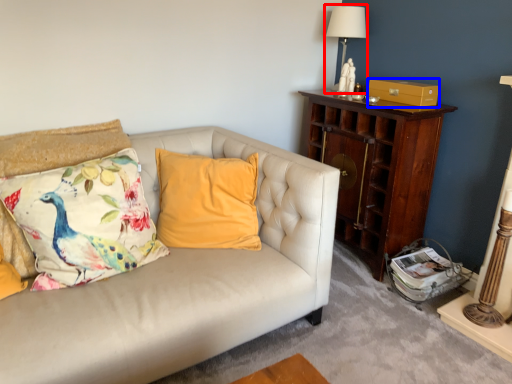
Question: Which object is further to the camera taking this photo, table lamp (highlighted by a red box) or drawer (highlighted by a blue box)?

Choices:
 (A) table lamp
 (B) drawer

Answer: (A)